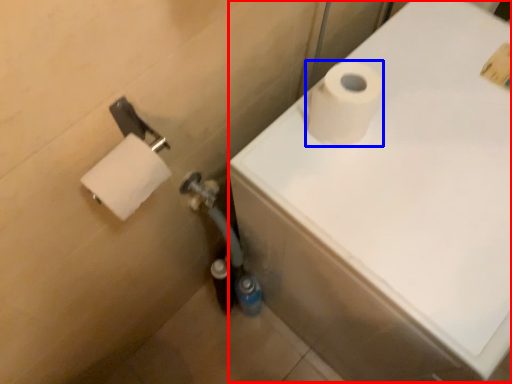
Question: Which point is further to the camera, bath (highlighted by a red box) or toilet paper (highlighted by a blue box)?

Choices:
 (A) bath
 (B) toilet paper

Answer: (B)